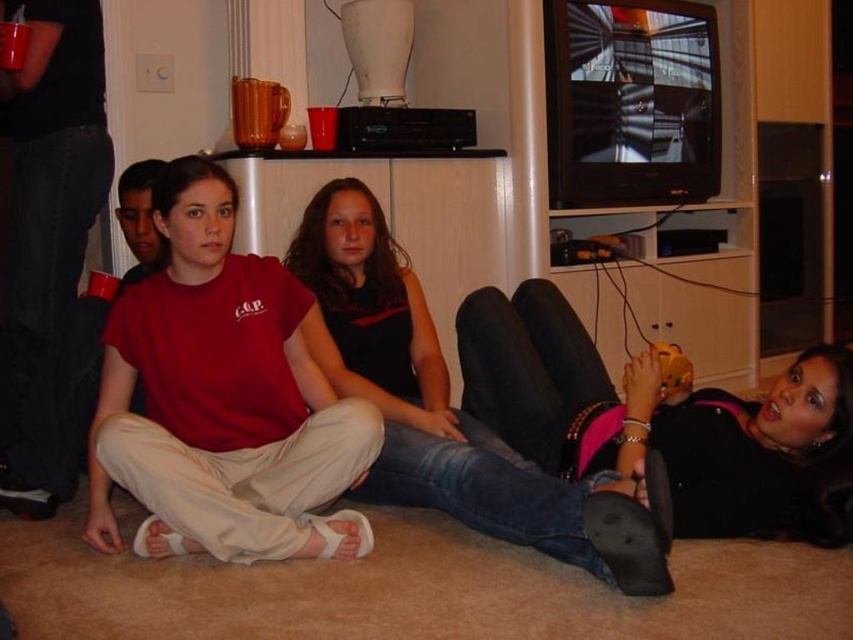
Which is more to the left, matte red t-shirt at center or jeans at center?

matte red t-shirt at center

Is matte red t-shirt at center to the left of jeans at center from the viewer's perspective?

Yes, matte red t-shirt at center is to the left of jeans at center.

You are a GUI agent. You are given a task and a screenshot of the screen. Output one action in this format:
    pyautogui.click(x=<x>, y=<y>)
    Task: Click on the matte red t-shirt at center
    Image resolution: width=853 pixels, height=640 pixels.
    Given the screenshot: What is the action you would take?
    pyautogui.click(x=222, y=396)